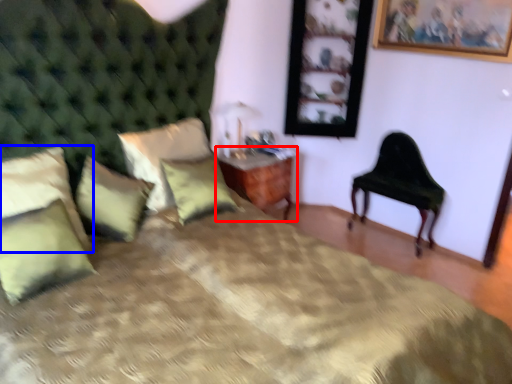
Question: Which object is closer to the camera taking this photo, nightstand (highlighted by a red box) or pillow (highlighted by a blue box)?

Choices:
 (A) nightstand
 (B) pillow

Answer: (B)